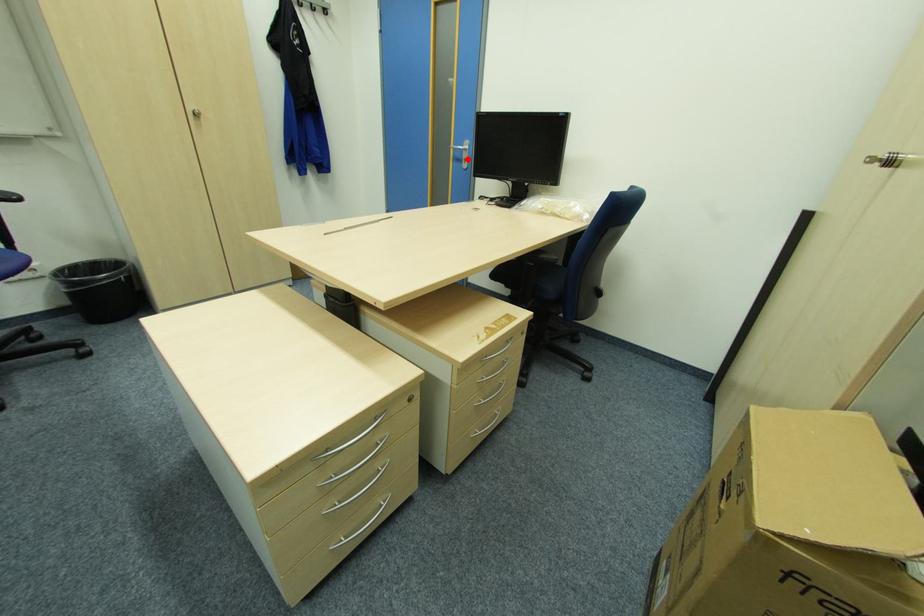
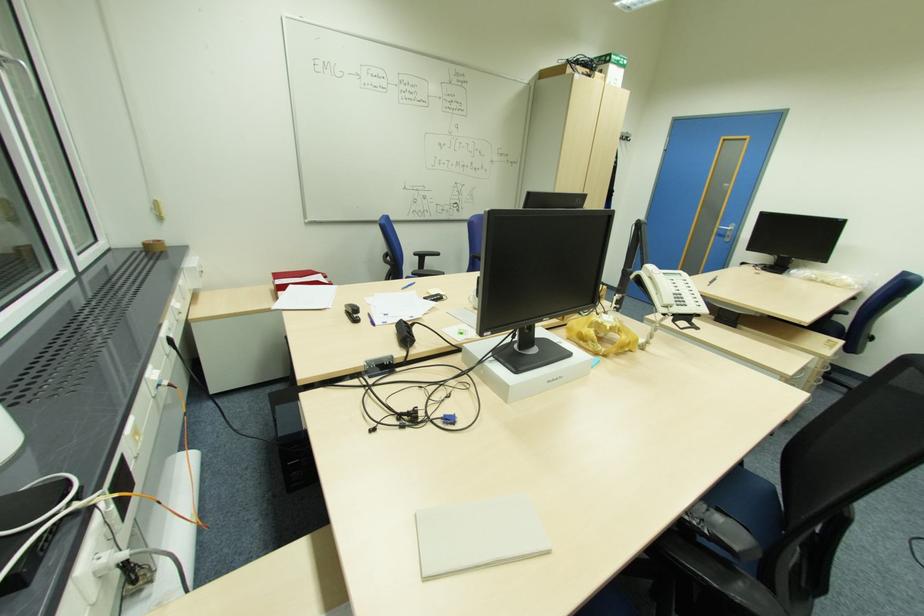
Where in the second image is the point corresponding to the highlighted location from the first image?

(732, 236)